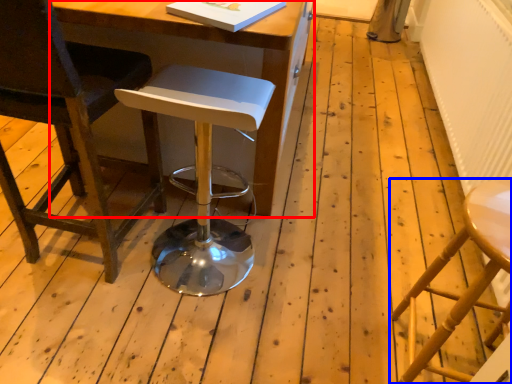
Question: Which object appears farthest to the camera in this image, table (highlighted by a red box) or stool (highlighted by a blue box)?

Choices:
 (A) table
 (B) stool

Answer: (A)